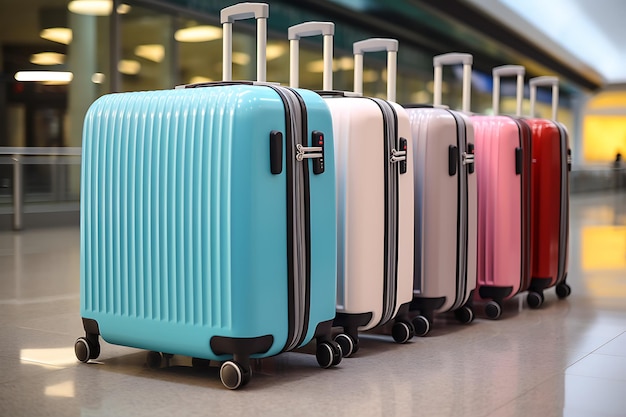
I want to click on handle, so click(x=245, y=6), click(x=303, y=26), click(x=376, y=44), click(x=449, y=54), click(x=506, y=68), click(x=548, y=77).